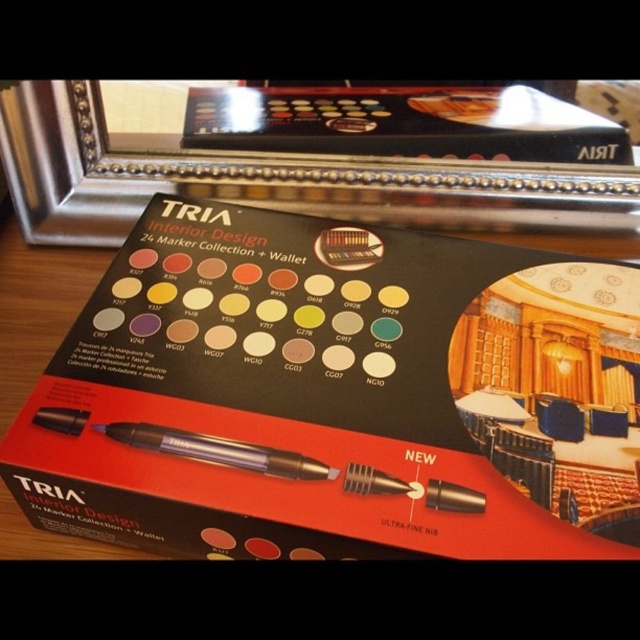
Based on the photo, you are a delivery person who needs to place a 22 cm long package on the desk. The desk has the black cardboard box at center and a translucent plastic pen at center. Can the package fit between them without overlapping?

The distance between the black cardboard box at center and the translucent plastic pen at center is 21.98 centimeters. Since the package is 22 cm long, it cannot fit between them without overlapping.

You are holding a TRIA Interior Design 24 Marker Collection box and want to place it on a shelf that is 1 meter away from you. Can you place the black cardboard box at center on the shelf?

The black cardboard box at center is 1.01 meters away from the viewer, which is slightly farther than the shelf distance of 1 meter. Therefore, you cannot place it on the shelf.

You are holding the black cardboard box at center and want to place the translucent plastic pen at center on top of it. Is the pen closer to you than the box?

The black cardboard box at center is closer to the viewer than the translucent plastic pen at center, so the pen is farther away. When placing the pen on top of the box, the pen would then be positioned above the box but still farther from the viewer compared to the box itself.